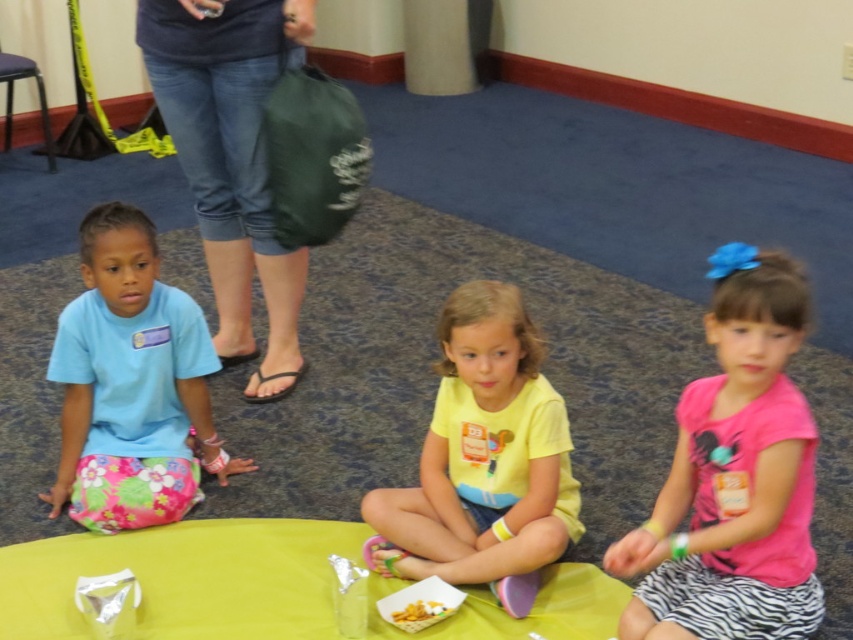
Which of these two, yellow matte shirt at center or yellow matte snack at center, stands shorter?

With less height is yellow matte snack at center.

Between point (444, 561) and point (433, 620), which one is positioned in front?

Positioned in front is point (433, 620).

Where is `yellow matte shirt at center`? This screenshot has height=640, width=853. yellow matte shirt at center is located at coordinates point(483,460).

Is pink fabric shirt at center to the right of light blue t-shirt at left from the viewer's perspective?

Correct, you'll find pink fabric shirt at center to the right of light blue t-shirt at left.

Is pink fabric shirt at center to the left of light blue t-shirt at left from the viewer's perspective?

Incorrect, pink fabric shirt at center is not on the left side of light blue t-shirt at left.

Which is in front, point (700, 408) or point (143, 472)?

Positioned in front is point (700, 408).

This screenshot has height=640, width=853. What are the coordinates of `pink fabric shirt at center` in the screenshot? It's located at (734, 476).

Who is taller, pink fabric shirt at center or yellow matte shirt at center?

Standing taller between the two is pink fabric shirt at center.

Can you confirm if pink fabric shirt at center is taller than yellow matte shirt at center?

Correct, pink fabric shirt at center is much taller as yellow matte shirt at center.

Does point (770, 508) come behind point (453, 307)?

No, it is in front of (453, 307).

In order to click on pink fabric shirt at center in this screenshot , I will do `click(734, 476)`.